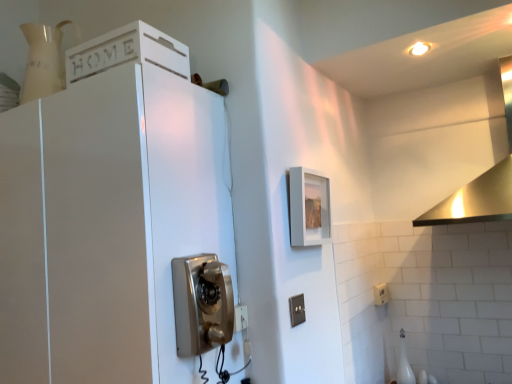
Question: Choose the correct answer: Is stainless steel vent at upper right inside black plastic switch at lower center, marked as the first electric outlet in a left-to-right arrangement, or outside it?

Choices:
 (A) outside
 (B) inside

Answer: (A)

Question: From a real-world perspective, is stainless steel vent at upper right above or below black plastic switch at lower center, which is the second electric outlet from back to front?

Choices:
 (A) above
 (B) below

Answer: (A)

Question: Which is nearer to the white plastic electric outlet at lower right, which ranks as the second electric outlet in front-to-back order?

Choices:
 (A) stainless steel vent at upper right
 (B) black plastic switch at lower center, which is the second electric outlet from back to front
 (C) metallic silver phone at center
 (D) white painted wood cabinet at upper left, positioned as the first cabinetry in top-to-bottom order
 (E) matte gray picture frame at upper center

Answer: (A)

Question: Which is nearer to the white painted wood cabinet at upper left, positioned as the first cabinetry in top-to-bottom order?

Choices:
 (A) black plastic switch at lower center, which is the second electric outlet from back to front
 (B) matte gray picture frame at upper center
 (C) white glossy cabinet at upper left, the 1th cabinetry from the bottom
 (D) stainless steel vent at upper right
 (E) metallic silver phone at center

Answer: (C)